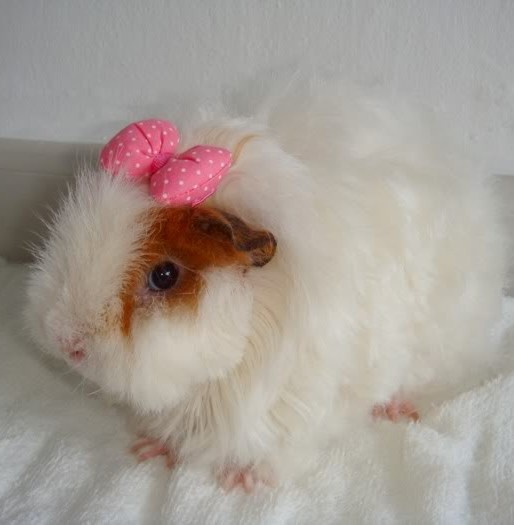
Image resolution: width=514 pixels, height=525 pixels. I want to click on white towel, so click(x=118, y=480).